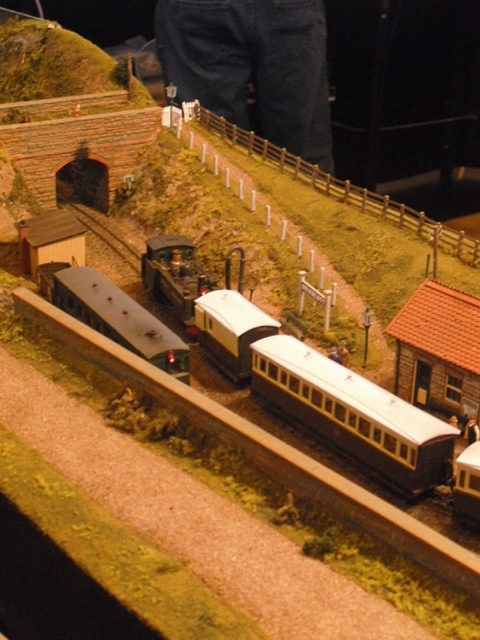
From the picture: You are standing at the edge of the model railway scene. You want to place a new decorative fence that is 10 feet long between the matte black train car at center and yourself. Is there enough space for the fence?

The distance between the matte black train car at center and the viewer is 15.72 feet. Since the decorative fence is only 10 feet long, there is enough space to place it between them.

You are standing at the camera position looking at the model railway scene. There is a specific point marked at coordinates point (251, 362). If you want to place a new decorative tree exactly 6 meters away from your current position, can you place it at that point?

The point (251, 362) is 5.95 meters from the camera, so yes, you can place the decorative tree there since it is approximately 6 meters away from your current position.

You are a model railway enthusiast who wants to place a new decorative tree exactly at the midpoint between the matte black train car at center and the fence. What are the coordinates of the point where you should place the tree?

The coordinates for the midpoint between the matte black train car at center and the fence would be calculated by averaging their coordinates. Since the train car is at point (352, 413), and the fence is parallel to the railway line but its exact coordinates aren